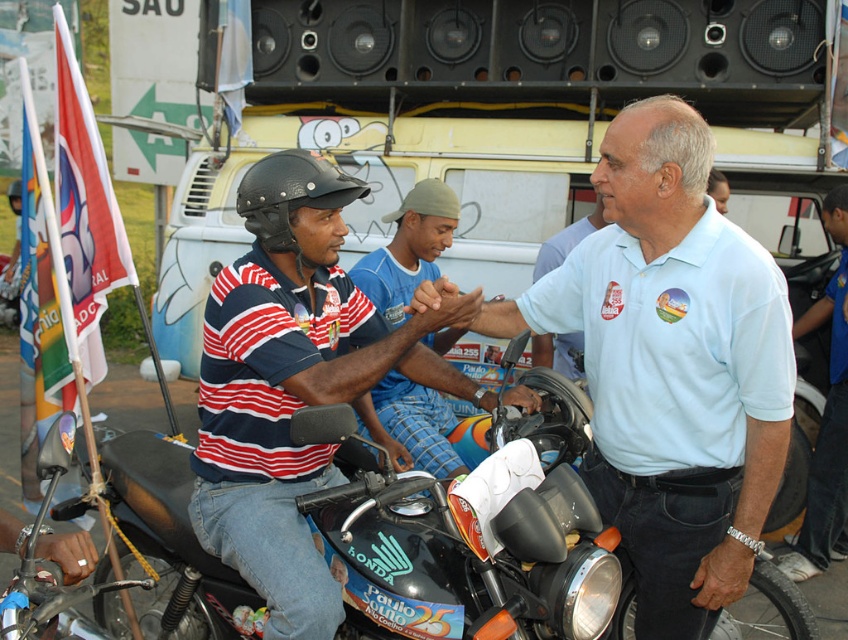
In the scene shown: Between light blue shirt at center and black glossy motorcycle at center, which one is positioned higher?

light blue shirt at center

Is light blue shirt at center shorter than black glossy motorcycle at center?

Incorrect, light blue shirt at center's height does not fall short of black glossy motorcycle at center's.

Does point (605, 509) come farther from viewer compared to point (298, 420)?

Yes, point (605, 509) is farther from viewer.

I want to click on light blue shirt at center, so click(672, 365).

Does black glossy motorcycle at center have a smaller size compared to black matte helmet at center?

Incorrect, black glossy motorcycle at center is not smaller in size than black matte helmet at center.

Is black glossy motorcycle at center to the right of black matte helmet at center from the viewer's perspective?

Indeed, black glossy motorcycle at center is positioned on the right side of black matte helmet at center.

Which is in front, point (416, 572) or point (266, 156)?

Point (416, 572) is in front.

Locate an element on the screen. This screenshot has width=848, height=640. black glossy motorcycle at center is located at coordinates pos(461,557).

Between light blue shirt at center and white cotton shirt at center, which one has more height?

Standing taller between the two is white cotton shirt at center.

Can you confirm if light blue shirt at center is positioned to the right of white cotton shirt at center?

No, light blue shirt at center is not to the right of white cotton shirt at center.

Is point (762, 260) positioned behind point (790, 538)?

No, (762, 260) is closer to viewer.

You are a GUI agent. You are given a task and a screenshot of the screen. Output one action in this format:
    pyautogui.click(x=<x>, y=<y>)
    Task: Click on the light blue shirt at center
    The width and height of the screenshot is (848, 640).
    Given the screenshot: What is the action you would take?
    (x=672, y=365)